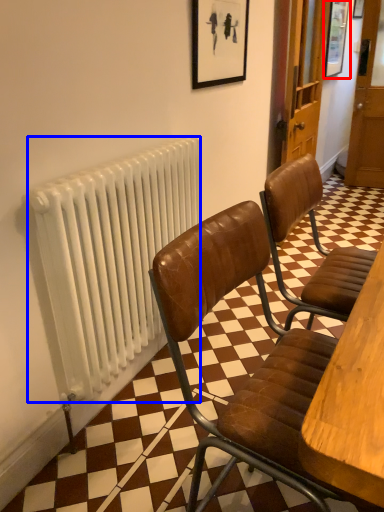
Question: Which point is closer to the camera, picture frame (highlighted by a red box) or radiator (highlighted by a blue box)?

Choices:
 (A) picture frame
 (B) radiator

Answer: (B)